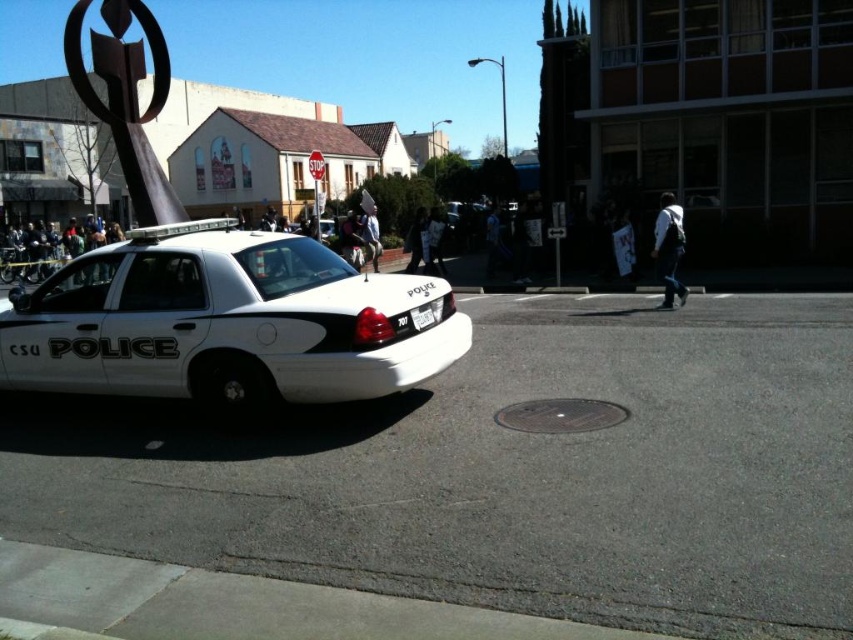
You are a pedestrian standing on the sidewalk and want to take a photo of the white glossy police car at center and the white plastic license plate at center. Which object should you zoom in on to ensure both are clearly visible in the photo?

The white glossy police car at center is bigger than the white plastic license plate at center, so you should zoom in on the white glossy police car at center to ensure both are clearly visible in the photo.

You are a pedestrian standing at the edge of the road. You see the white glossy police car at center and the white plastic license plate at center. Which object is taller?

The white glossy police car at center is much taller than the white plastic license plate at center.